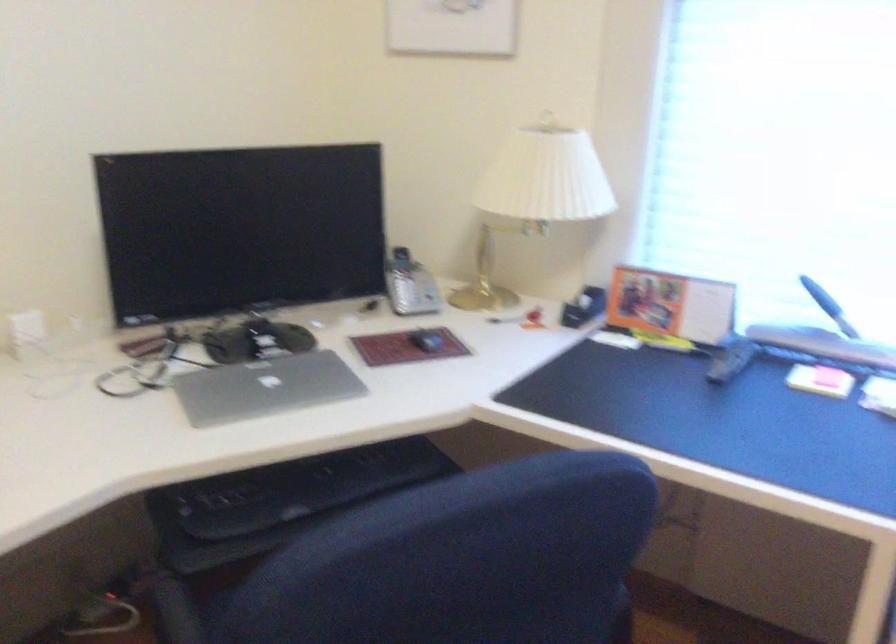
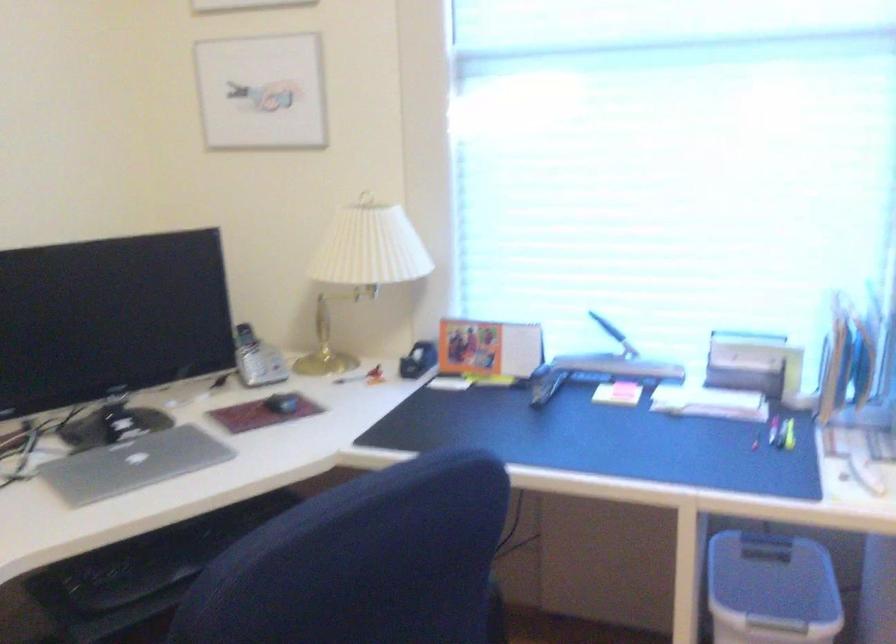
The point at (263,386) is marked in the first image. Where is the corresponding point in the second image?

(133, 464)